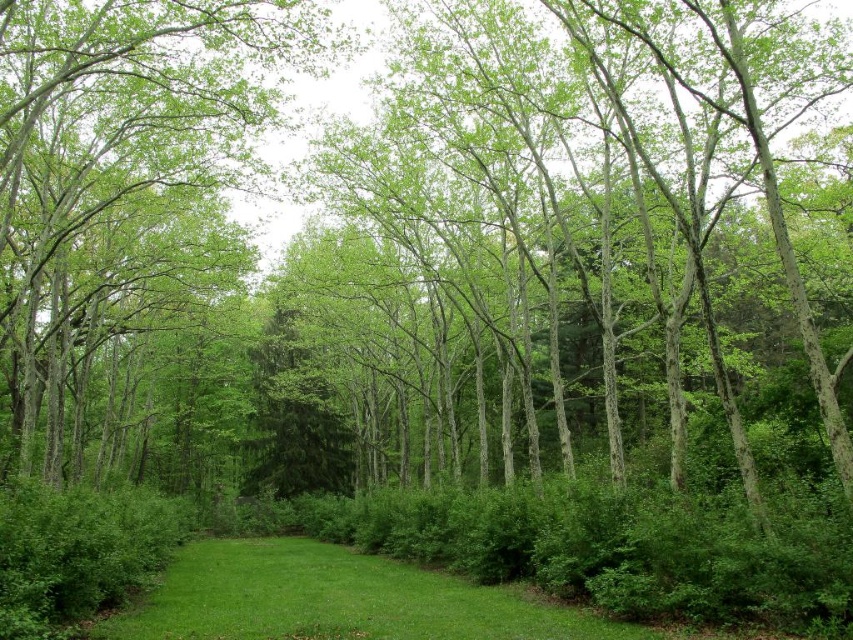
Does point (102, 326) lie behind point (387, 564)?

Yes, it is.

Can you confirm if green leafy tree at center is positioned to the left of green grass at center?

Correct, you'll find green leafy tree at center to the left of green grass at center.

What are the coordinates of `green leafy tree at center` in the screenshot? It's located at (123, 173).